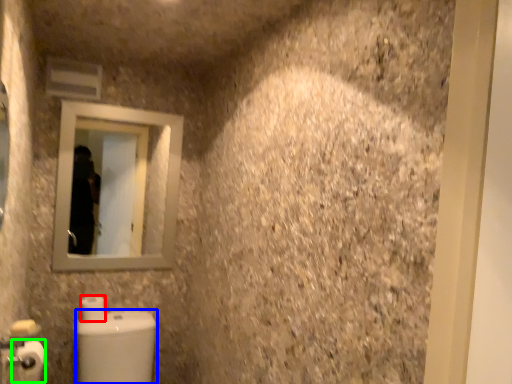
Question: Considering the real-world distances, which object is farthest from toilet paper (highlighted by a red box)? toilet bowl (highlighted by a blue box) or toilet paper (highlighted by a green box)?

Choices:
 (A) toilet bowl
 (B) toilet paper

Answer: (B)